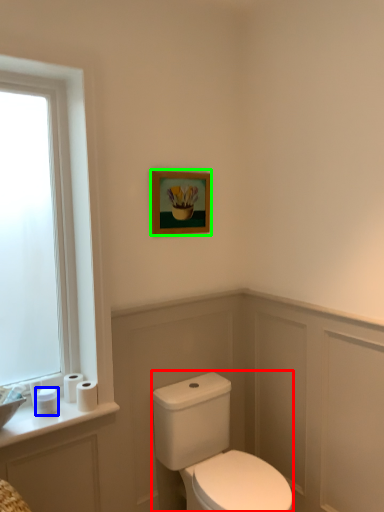
Question: Based on their relative distances, which object is nearer to porcelain (highlighted by a red box)? Choose from toilet paper (highlighted by a blue box) and picture frame (highlighted by a green box).

Choices:
 (A) toilet paper
 (B) picture frame

Answer: (A)